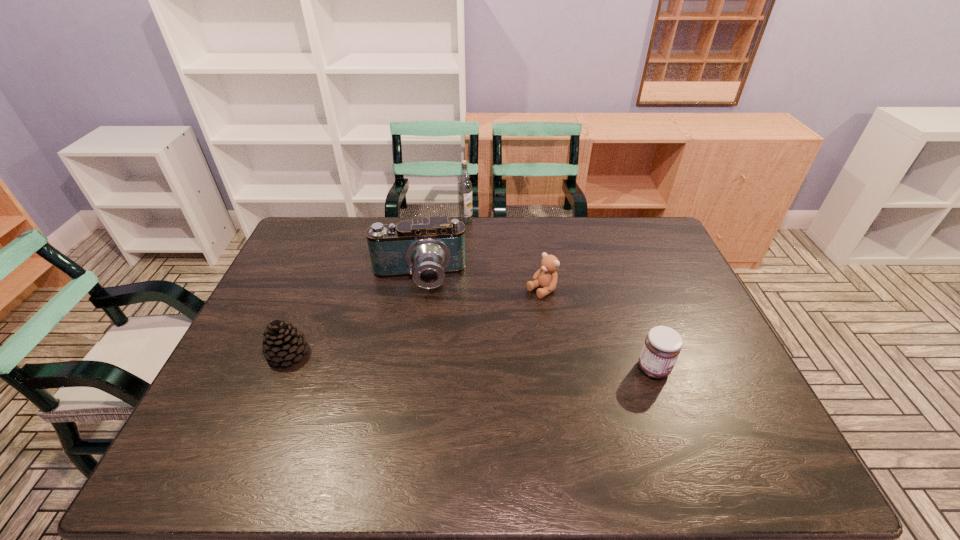
Image resolution: width=960 pixels, height=540 pixels. Find the location of `pinecone`. pinecone is located at coordinates (282, 343).

Where is `the rightmost object`? the rightmost object is located at coordinates (662, 346).

This screenshot has width=960, height=540. What are the coordinates of `the second object from right to left` in the screenshot? It's located at (546, 277).

You are a GUI agent. You are given a task and a screenshot of the screen. Output one action in this format:
    pyautogui.click(x=<x>, y=<y>)
    Task: Click on the tallest object
    
    Given the screenshot: What is the action you would take?
    pyautogui.click(x=464, y=185)

The height and width of the screenshot is (540, 960). What are the coordinates of `the farthest object` in the screenshot? It's located at (464, 185).

I want to click on the second tallest object, so click(x=427, y=249).

Where is `blank area located at the narrow end of the pinecone`? This screenshot has width=960, height=540. blank area located at the narrow end of the pinecone is located at coordinates (410, 353).

Where is `free spot located 0.160m on the front label of the jam`? This screenshot has width=960, height=540. free spot located 0.160m on the front label of the jam is located at coordinates (732, 368).

This screenshot has height=540, width=960. Identify the location of vacant space located 0.230m on the front-facing side of the teddy bear. (471, 334).

Locate an element on the screen. The height and width of the screenshot is (540, 960). free spot located 0.260m on the front-facing side of the teddy bear is located at coordinates (463, 339).